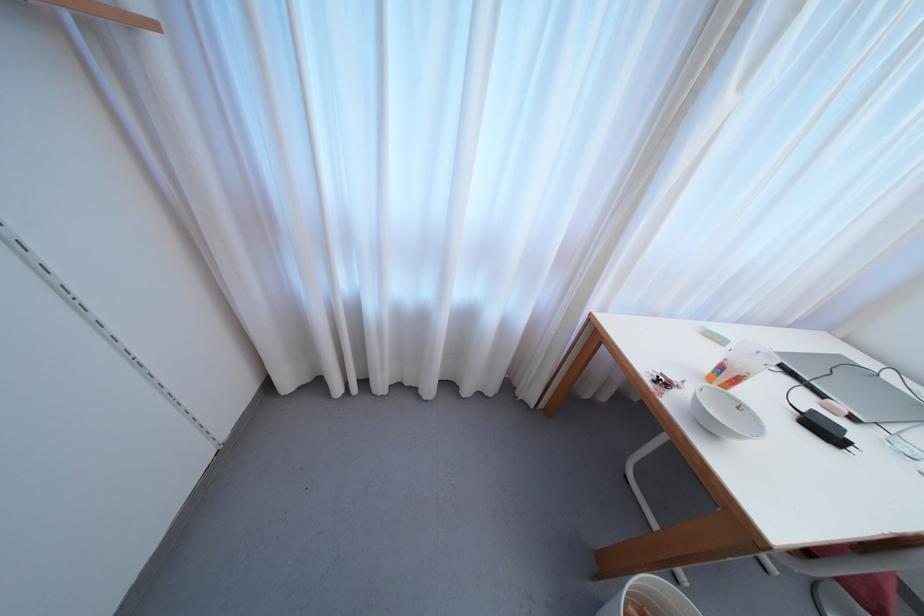
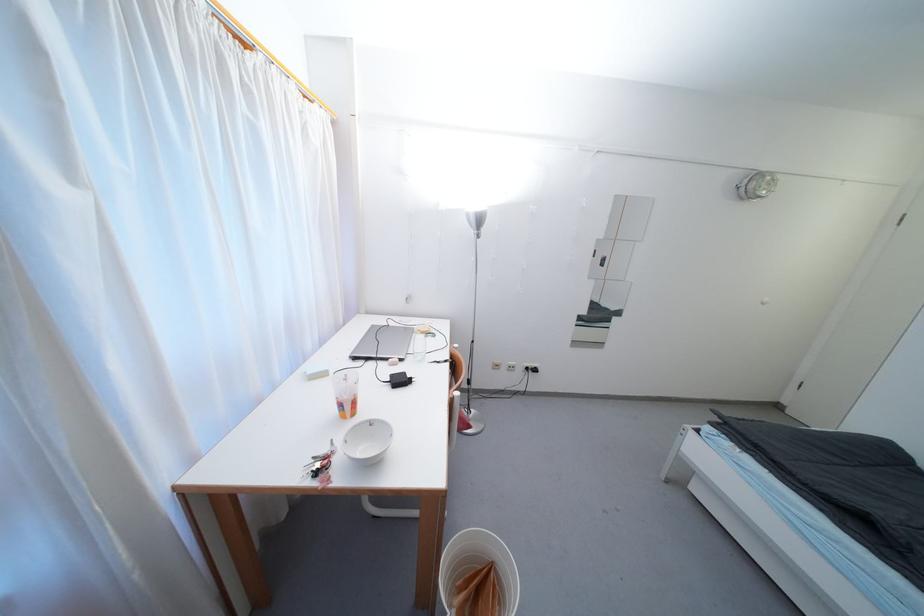
Where in the second image is the point corresponding to (x=762, y=355) from the first image?

(349, 378)